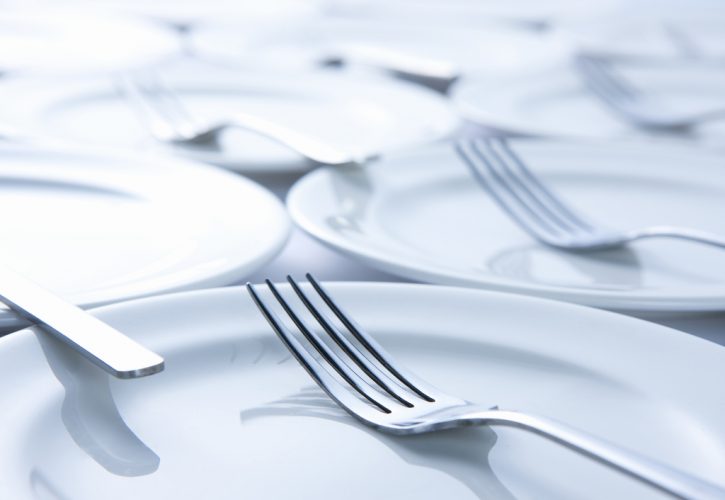
Find the location of `fork`. fork is located at coordinates (450, 418), (116, 346), (596, 236), (175, 129), (665, 112), (689, 51).